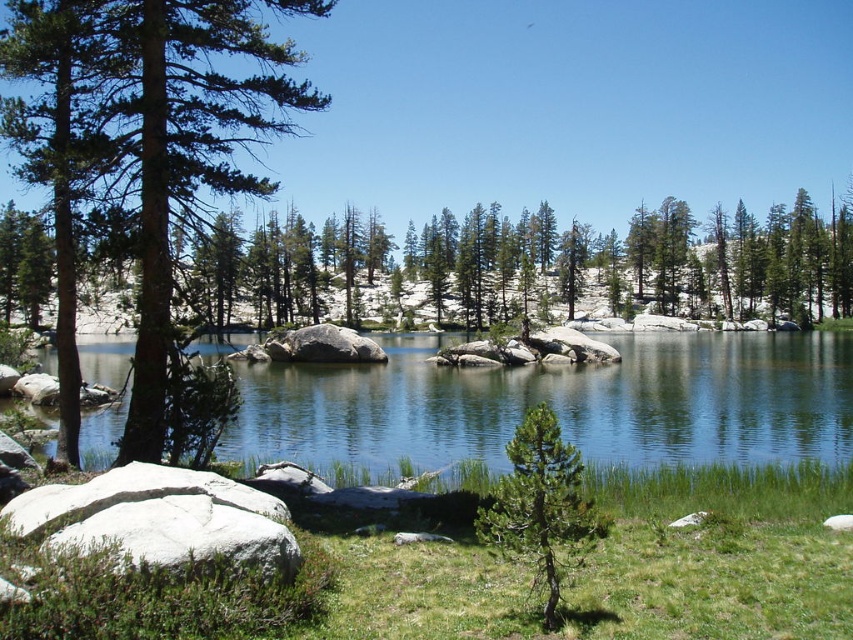
Looking at this image, you are a photographer standing at the edge of the lake, aiming to capture a photo of both the clear blue water at center and the green matte tree at center. If your camera has a maximum focus range of 40 meters, will you be able to focus on both subjects simultaneously?

The clear blue water at center is 42.87 meters from the green matte tree at center. Since the distance between them exceeds the camera maximum focus range of 40 meters, you cannot focus on both subjects simultaneously.

You are standing at the edge of the lake and want to throw a stone into the water. If you aim for the clear blue water at center and the gray rough boulder at center, which one will your stone hit first?

The clear blue water at center is closer to the viewer than the gray rough boulder at center, so your stone will hit the clear blue water at center first.